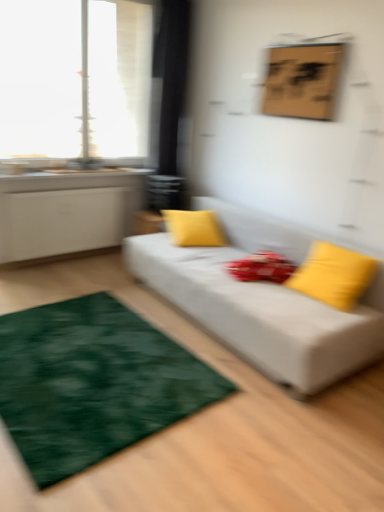
What do you see at coordinates (93, 383) in the screenshot? The image size is (384, 512). I see `green plush rug at lower left` at bounding box center [93, 383].

The width and height of the screenshot is (384, 512). What do you see at coordinates (40, 79) in the screenshot? I see `transparent glass window at upper left` at bounding box center [40, 79].

The width and height of the screenshot is (384, 512). What do you see at coordinates (262, 301) in the screenshot?
I see `white fabric couch at center` at bounding box center [262, 301].

Identify the location of yellow fabric pillow at center, the first pillow positioned from the back. (193, 228).

Consider the image. Which of these two, wooden board at upper center or yellow matte pillow at right, which is the second pillow in left-to-right order, stands taller?

yellow matte pillow at right, which is the second pillow in left-to-right order, is taller.

Is wooden board at upper center not near yellow matte pillow at right, placed as the second pillow when sorted from back to front?

Yes, wooden board at upper center is far from yellow matte pillow at right, placed as the second pillow when sorted from back to front.

From the image's perspective, is wooden board at upper center above yellow matte pillow at right, placed as the second pillow when sorted from back to front?

Yes, from the image's perspective, wooden board at upper center is on top of yellow matte pillow at right, placed as the second pillow when sorted from back to front.

From a real-world perspective, is yellow fabric pillow at center, which is counted as the second pillow, starting from the front, above or below white fabric couch at center?

In terms of real-world spatial position, yellow fabric pillow at center, which is counted as the second pillow, starting from the front, is above white fabric couch at center.

Which of these two, yellow fabric pillow at center, the first pillow positioned from the back, or white fabric couch at center, stands shorter?

Standing shorter between the two is yellow fabric pillow at center, the first pillow positioned from the back.

How many degrees apart are the facing directions of yellow fabric pillow at center, the first pillow when ordered from left to right, and white fabric couch at center?

yellow fabric pillow at center, the first pillow when ordered from left to right, and white fabric couch at center are facing 68.4 degrees away from each other.

Which is less distant, (x=175, y=210) or (x=231, y=259)?

Point (x=175, y=210) is farther from the camera than point (x=231, y=259).

Considering the relative sizes of yellow fabric pillow at center, the first pillow when ordered from left to right, and transparent glass window at upper left in the image provided, is yellow fabric pillow at center, the first pillow when ordered from left to right, bigger than transparent glass window at upper left?

Actually, yellow fabric pillow at center, the first pillow when ordered from left to right, might be smaller than transparent glass window at upper left.

Who is taller, yellow fabric pillow at center, which is counted as the second pillow, starting from the front, or transparent glass window at upper left?

transparent glass window at upper left is taller.

At what (x,y) coordinates should I click in order to perform the action: click on window above the yellow fabric pillow at center, the first pillow when ordered from left to right (from the image's perspective). Please return your answer as a coordinate pair (x, y). The image size is (384, 512). Looking at the image, I should click on (40, 79).

Where is `studio couch located on the right of transparent glass window at upper left`? This screenshot has width=384, height=512. studio couch located on the right of transparent glass window at upper left is located at coordinates (262, 301).

From the image's perspective, is transparent glass window at upper left beneath white fabric couch at center?

No, from the image's perspective, transparent glass window at upper left is not beneath white fabric couch at center.

Does point (0, 94) lie behind point (260, 302)?

Yes, point (0, 94) is behind point (260, 302).

Is the depth of transparent glass window at upper left less than that of white fabric couch at center?

No, it is behind white fabric couch at center.

Which point is more forward, (301,362) or (70,87)?

Positioned in front is point (301,362).

Which of these two, white fabric couch at center or transparent glass window at upper left, is bigger?

white fabric couch at center is bigger.

Considering the sizes of objects white fabric couch at center and transparent glass window at upper left in the image provided, who is wider, white fabric couch at center or transparent glass window at upper left?

white fabric couch at center.

Considering the relative positions of yellow matte pillow at right, which is the first pillow from front to back, and white fabric couch at center in the image provided, is yellow matte pillow at right, which is the first pillow from front to back, in front of white fabric couch at center?

No, yellow matte pillow at right, which is the first pillow from front to back, is behind white fabric couch at center.

Is yellow matte pillow at right, placed as the second pillow when sorted from back to front, in contact with white fabric couch at center?

No, yellow matte pillow at right, placed as the second pillow when sorted from back to front, is not touching white fabric couch at center.

Is white fabric couch at center at the back of yellow matte pillow at right, placed as the first pillow when sorted from right to left?

Yes.

Considering the relative positions of yellow matte pillow at right, which is the second pillow in left-to-right order, and white fabric couch at center in the image provided, is yellow matte pillow at right, which is the second pillow in left-to-right order, to the left of white fabric couch at center from the viewer's perspective?

Incorrect, yellow matte pillow at right, which is the second pillow in left-to-right order, is not on the left side of white fabric couch at center.

Which is in front, green plush rug at lower left or yellow matte pillow at right, placed as the second pillow when sorted from back to front?

green plush rug at lower left.

From a real-world perspective, is green plush rug at lower left physically below yellow matte pillow at right, placed as the second pillow when sorted from back to front?

Correct, in the physical world, green plush rug at lower left is lower than yellow matte pillow at right, placed as the second pillow when sorted from back to front.

Which is behind, point (55, 352) or point (309, 282)?

Point (309, 282)

Can you tell me how much green plush rug at lower left and yellow matte pillow at right, which is the second pillow in left-to-right order, differ in facing direction?

The facing directions of green plush rug at lower left and yellow matte pillow at right, which is the second pillow in left-to-right order, are 94.9 degrees apart.

Find the location of a particular element. This screenshot has height=512, width=384. picture frame behind the yellow matte pillow at right, which is the second pillow in left-to-right order is located at coordinates (302, 80).

Identify the location of studio couch below the yellow fabric pillow at center, which is counted as the second pillow, starting from the front (from the image's perspective). The width and height of the screenshot is (384, 512). (262, 301).

Considering their positions, is yellow fabric pillow at center, the first pillow when ordered from left to right, positioned closer to transparent glass window at upper left than white fabric couch at center?

Based on the image, yellow fabric pillow at center, the first pillow when ordered from left to right, appears to be nearer to transparent glass window at upper left.

From the image, which object appears to be farther from white fabric couch at center, yellow matte pillow at right, which is the first pillow from front to back, or transparent glass window at upper left?

The object further to white fabric couch at center is transparent glass window at upper left.

From the image, which object appears to be nearer to yellow fabric pillow at center, the first pillow positioned from the back, white fabric couch at center or green plush rug at lower left?

Based on the image, white fabric couch at center appears to be nearer to yellow fabric pillow at center, the first pillow positioned from the back.

Which object lies nearer to the anchor point green plush rug at lower left, white fabric couch at center or yellow fabric pillow at center, which is counted as the second pillow, starting from the front?

white fabric couch at center lies closer to green plush rug at lower left than the other object.

From the image, which object appears to be farther from yellow fabric pillow at center, which is counted as the second pillow, starting from the front, transparent glass window at upper left or green plush rug at lower left?

transparent glass window at upper left lies further to yellow fabric pillow at center, which is counted as the second pillow, starting from the front, than the other object.

When comparing their distances from white fabric couch at center, does wooden board at upper center or yellow matte pillow at right, which is the first pillow from front to back, seem further?

wooden board at upper center is positioned further to the anchor white fabric couch at center.

Considering their positions, is yellow fabric pillow at center, the first pillow positioned from the back, positioned closer to green plush rug at lower left than wooden board at upper center?

Based on the image, yellow fabric pillow at center, the first pillow positioned from the back, appears to be nearer to green plush rug at lower left.

When comparing their distances from transparent glass window at upper left, does yellow fabric pillow at center, the first pillow positioned from the back, or wooden board at upper center seem closer?

The object closer to transparent glass window at upper left is yellow fabric pillow at center, the first pillow positioned from the back.

Locate an element on the screen. studio couch between green plush rug at lower left and yellow fabric pillow at center, the first pillow when ordered from left to right, along the z-axis is located at coordinates (262, 301).

Locate an element on the screen. Image resolution: width=384 pixels, height=512 pixels. picture frame that lies between transparent glass window at upper left and green plush rug at lower left from top to bottom is located at coordinates (302, 80).

Locate an element on the screen. The height and width of the screenshot is (512, 384). studio couch between wooden board at upper center and green plush rug at lower left in the vertical direction is located at coordinates (262, 301).

Locate an element on the screen. This screenshot has height=512, width=384. studio couch located between transparent glass window at upper left and wooden board at upper center in the left-right direction is located at coordinates (262, 301).